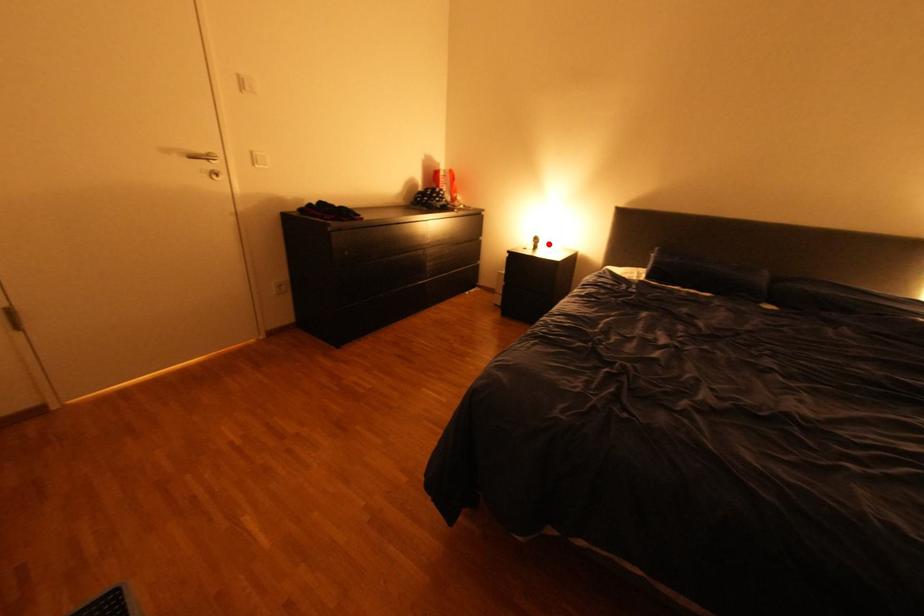
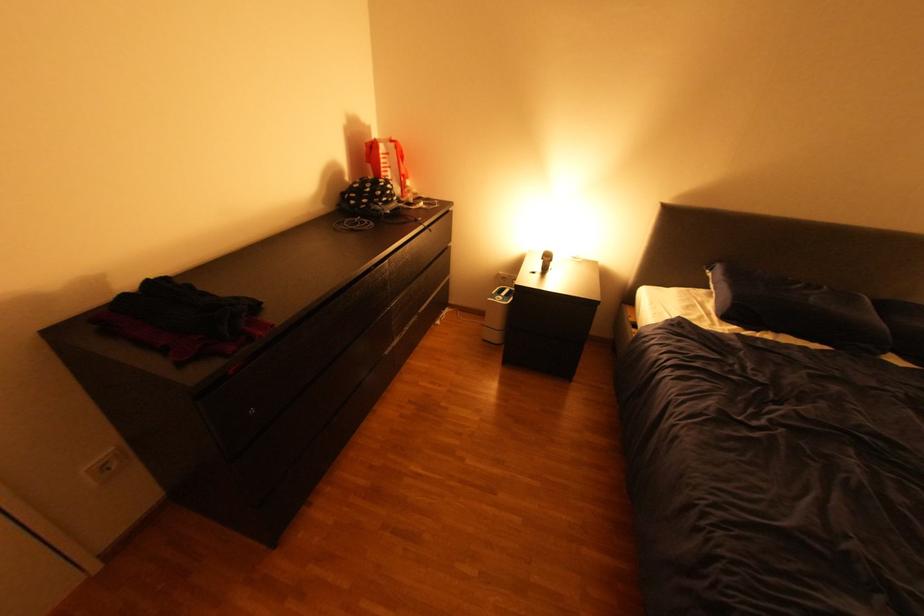
Locate, in the second image, the point that corresponds to the highlighted location in the first image.

(561, 262)